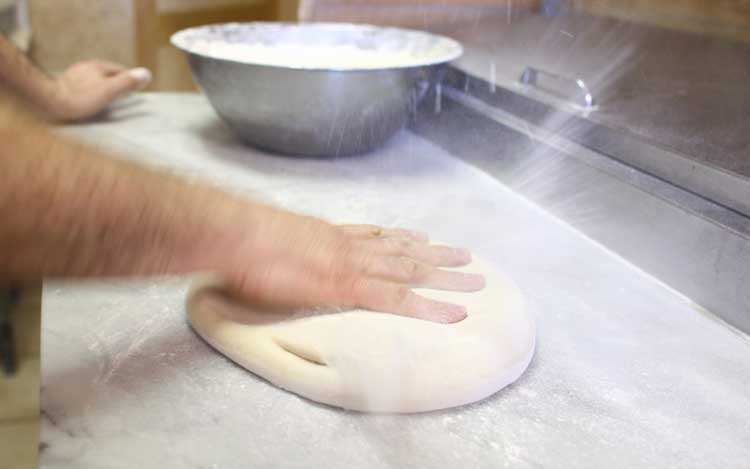
This screenshot has height=469, width=750. Identify the location of handle. (570, 79).